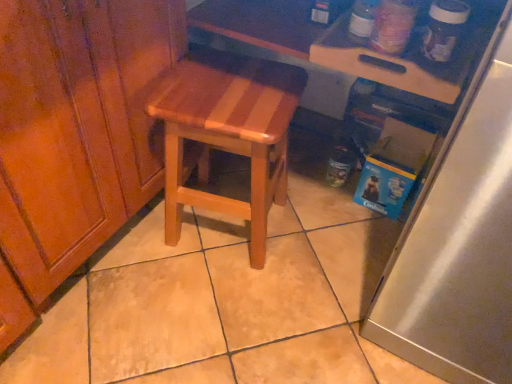
Question: From the image's perspective, relative to wooden at center, is wooden cutting board at upper right above or below?

Choices:
 (A) below
 (B) above

Answer: (B)

Question: Based on their positions, is wooden cutting board at upper right located to the left or right of wooden at center?

Choices:
 (A) left
 (B) right

Answer: (B)

Question: Which of these objects is positioned farthest from the satin silver refrigerator at right?

Choices:
 (A) wooden cutting board at upper right
 (B) wooden at center

Answer: (B)

Question: Estimate the real-world distances between objects in this image. Which object is closer to the wooden at center?

Choices:
 (A) satin silver refrigerator at right
 (B) wooden cutting board at upper right

Answer: (B)